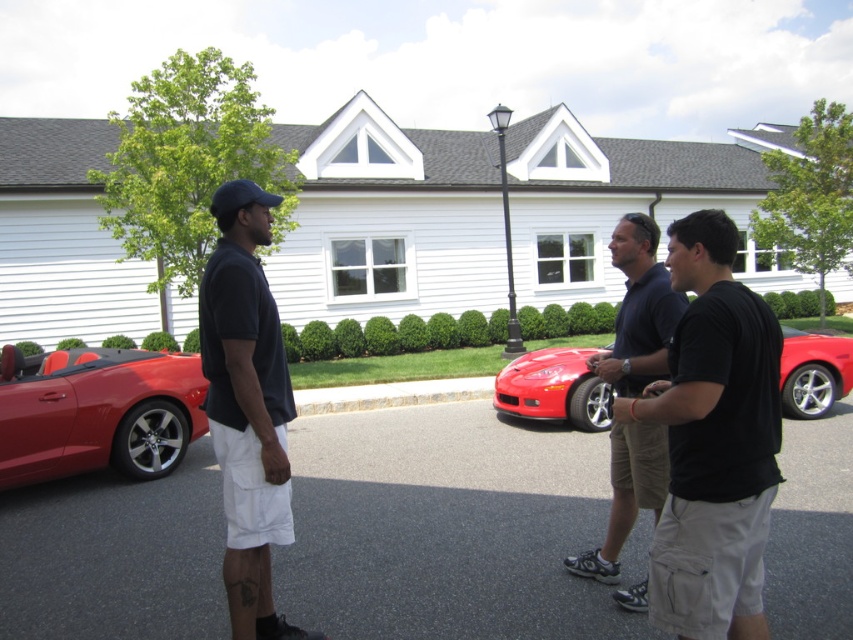
Does point (724, 356) lie behind point (520, 362)?

That is False.

Who is lower down, black cotton t-shirt at center or glossy red sports car at center?

glossy red sports car at center

Is point (677, 572) closer to camera compared to point (608, 428)?

Yes, point (677, 572) is closer to viewer.

At what (x,y) coordinates should I click in order to perform the action: click on black cotton t-shirt at center. Please return your answer as a coordinate pair (x, y). Image resolution: width=853 pixels, height=640 pixels. Looking at the image, I should click on (712, 442).

Is shiny red convertible at left above glossy red sports car at center?

Yes, shiny red convertible at left is above glossy red sports car at center.

This screenshot has width=853, height=640. Describe the element at coordinates (97, 412) in the screenshot. I see `shiny red convertible at left` at that location.

Is point (151, 371) farther from viewer compared to point (505, 378)?

No, (151, 371) is in front of (505, 378).

The width and height of the screenshot is (853, 640). What are the coordinates of `shiny red convertible at left` in the screenshot? It's located at (97, 412).

What do you see at coordinates (712, 442) in the screenshot? I see `black cotton t-shirt at center` at bounding box center [712, 442].

Consider the image. Can you confirm if black cotton t-shirt at center is bigger than dark blue shirt at center?

No, black cotton t-shirt at center is not bigger than dark blue shirt at center.

Is point (614, 412) positioned before point (281, 477)?

Yes, it is in front of point (281, 477).

The height and width of the screenshot is (640, 853). What are the coordinates of `black cotton t-shirt at center` in the screenshot? It's located at (712, 442).